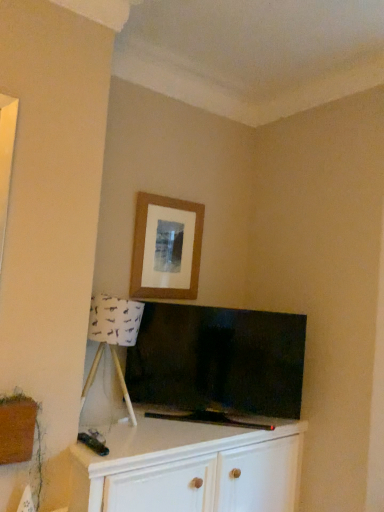
This screenshot has width=384, height=512. What are the coordinates of `vacant area situated below white fabric lampshade at lower left (from a real-world perspective)` in the screenshot? It's located at (102, 421).